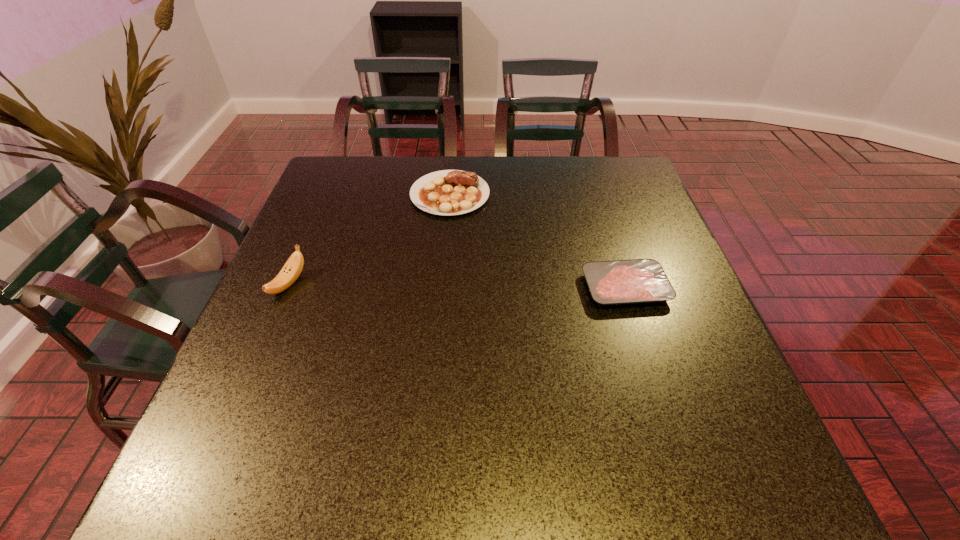
Where is `free area in between the banana and the shortest object`? The height and width of the screenshot is (540, 960). free area in between the banana and the shortest object is located at coordinates (457, 286).

Find the location of `vacant space that is in between the banana and the nearer steak`. vacant space that is in between the banana and the nearer steak is located at coordinates (457, 286).

Image resolution: width=960 pixels, height=540 pixels. Find the location of `free space between the farther steak and the right steak`. free space between the farther steak and the right steak is located at coordinates (538, 241).

The height and width of the screenshot is (540, 960). Find the location of `empty location between the second shortest object and the tallest object`. empty location between the second shortest object and the tallest object is located at coordinates (370, 239).

Image resolution: width=960 pixels, height=540 pixels. Identify the location of unoccupied area between the nearer steak and the farther steak. (538, 241).

I want to click on vacant area that lies between the shorter steak and the taller steak, so click(x=538, y=241).

Identify the location of free space between the farthest object and the tallest object. This screenshot has height=540, width=960. (370, 239).

Identify the location of empty space between the leftmost object and the second tallest object. (370, 239).

This screenshot has width=960, height=540. What are the coordinates of `vacant space that's between the tallest object and the shortest object` in the screenshot? It's located at (457, 286).

Select which object appears as the closest to the left steak. Please provide its 2D coordinates. Your answer should be formatted as a tuple, i.e. [(x, y)], where the tuple contains the x and y coordinates of a point satisfying the conditions above.

[(615, 282)]